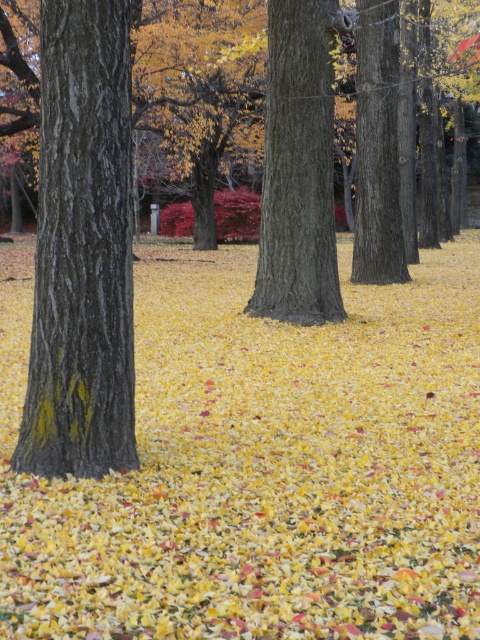
Can you confirm if smooth bark tree at left is positioned below smooth bark tree at center?

Correct, smooth bark tree at left is located below smooth bark tree at center.

Looking at this image, between smooth bark tree at left and smooth bark tree at center, which one has more height?

smooth bark tree at left

Is point (115, 280) positioned in front of point (374, 77)?

Yes, point (115, 280) is in front of point (374, 77).

I want to click on smooth bark tree at left, so click(x=82, y=250).

Is smooth bark tree at left to the right of smooth brown tree trunk at center from the viewer's perspective?

No, smooth bark tree at left is not to the right of smooth brown tree trunk at center.

Does smooth bark tree at left have a larger size compared to smooth brown tree trunk at center?

Incorrect, smooth bark tree at left is not larger than smooth brown tree trunk at center.

Is point (35, 340) behind point (282, 65)?

No, it is not.

You are a GUI agent. You are given a task and a screenshot of the screen. Output one action in this format:
    pyautogui.click(x=<x>, y=<y>)
    Task: Click on the smooth bark tree at left
    
    Given the screenshot: What is the action you would take?
    pyautogui.click(x=82, y=250)

Can you confirm if smooth brown tree trunk at center is positioned to the right of smooth bark tree at center?

Incorrect, smooth brown tree trunk at center is not on the right side of smooth bark tree at center.

Describe the element at coordinates (298, 170) in the screenshot. This screenshot has width=480, height=640. I see `smooth brown tree trunk at center` at that location.

The width and height of the screenshot is (480, 640). Find the location of `smooth brown tree trunk at center`. smooth brown tree trunk at center is located at coordinates (298, 170).